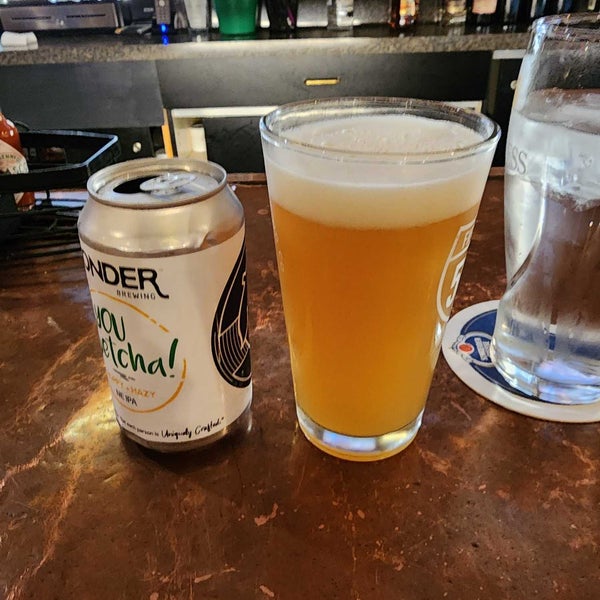
At what (x,y) coordinates should I click in order to perform the action: click on glass. Please return your answer as a coordinate pair (x, y). Looking at the image, I should click on pyautogui.click(x=418, y=170).